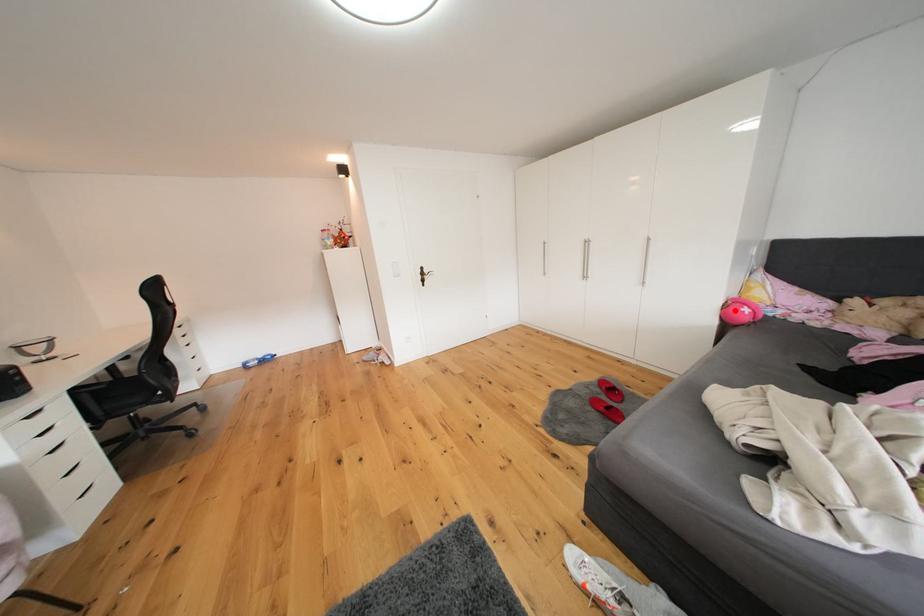
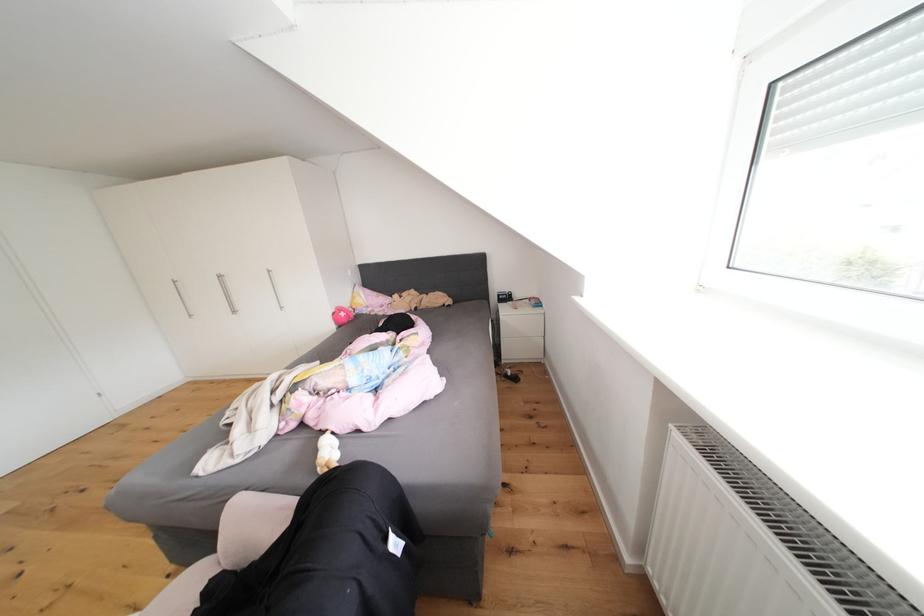
Question: I am providing you with two images of the same scene from different viewpoints. A red point is marked on the first image. Can you still see the location of the red point in image 2?

Choices:
 (A) Yes
 (B) No

Answer: (A)